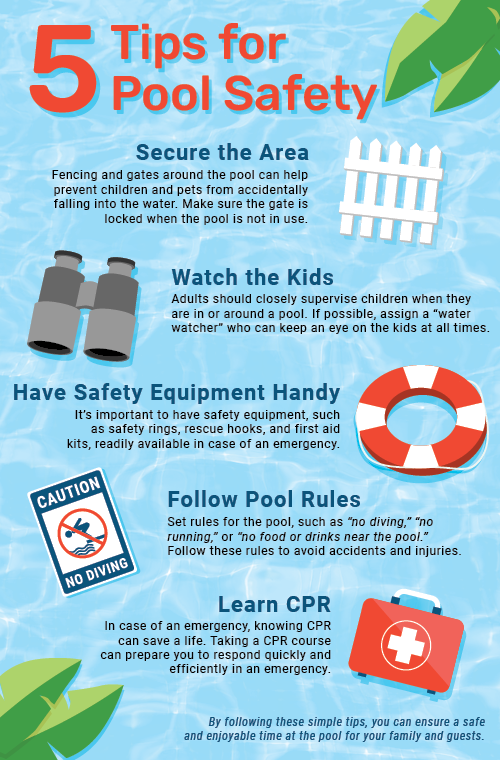
Where is `handle`? The width and height of the screenshot is (500, 760). handle is located at coordinates (416, 594).